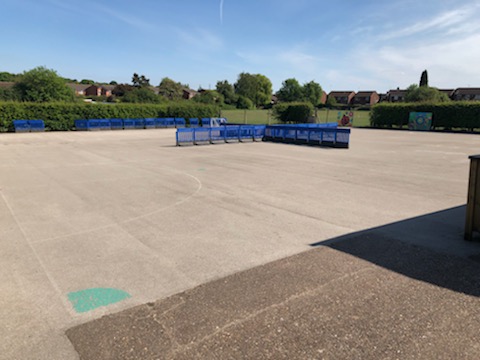
At what (x,y) coordinates should I click in order to perform the action: click on poster. Please return your answer as a coordinate pair (x, y). Looking at the image, I should click on (347, 119), (425, 122).